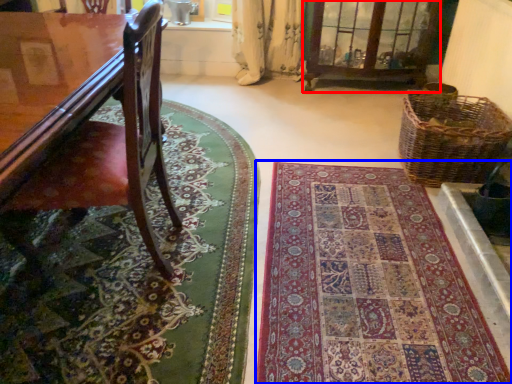
Question: Which object is further to the camera taking this photo, bay window (highlighted by a red box) or mat (highlighted by a blue box)?

Choices:
 (A) bay window
 (B) mat

Answer: (A)